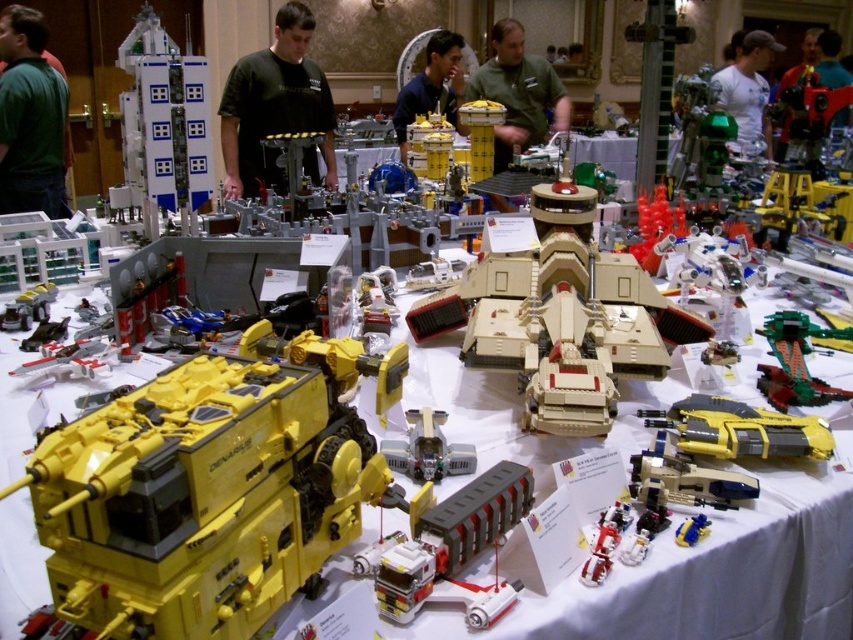
The width and height of the screenshot is (853, 640). What do you see at coordinates (747, 86) in the screenshot? I see `white matte shirt at upper right` at bounding box center [747, 86].

Does white matte shirt at upper right have a lesser width compared to shiny red plastic robot at center?

No, white matte shirt at upper right is not thinner than shiny red plastic robot at center.

The height and width of the screenshot is (640, 853). What do you see at coordinates (747, 86) in the screenshot? I see `white matte shirt at upper right` at bounding box center [747, 86].

Where is `white matte shirt at upper right`? This screenshot has height=640, width=853. white matte shirt at upper right is located at coordinates (747, 86).

Is black shirt at center to the left of green plastic toy at center-right from the viewer's perspective?

Correct, you'll find black shirt at center to the left of green plastic toy at center-right.

How much distance is there between black shirt at center and green plastic toy at center-right?

The distance of black shirt at center from green plastic toy at center-right is 8.91 feet.

Is point (263, 76) closer to camera compared to point (776, 381)?

No, (263, 76) is behind (776, 381).

Locate an element on the screen. This screenshot has width=853, height=640. black shirt at center is located at coordinates (274, 106).

Between tan matte tank at center and white plastic building at upper left, which one is positioned lower?

tan matte tank at center is lower down.

Between tan matte tank at center and white plastic building at upper left, which one has more height?

With more height is white plastic building at upper left.

Describe the element at coordinates (558, 312) in the screenshot. Image resolution: width=853 pixels, height=640 pixels. I see `tan matte tank at center` at that location.

You are a GUI agent. You are given a task and a screenshot of the screen. Output one action in this format:
    pyautogui.click(x=<x>, y=<y>)
    Task: Click on the tan matte tank at center
    The height and width of the screenshot is (640, 853).
    Given the screenshot: What is the action you would take?
    (558, 312)